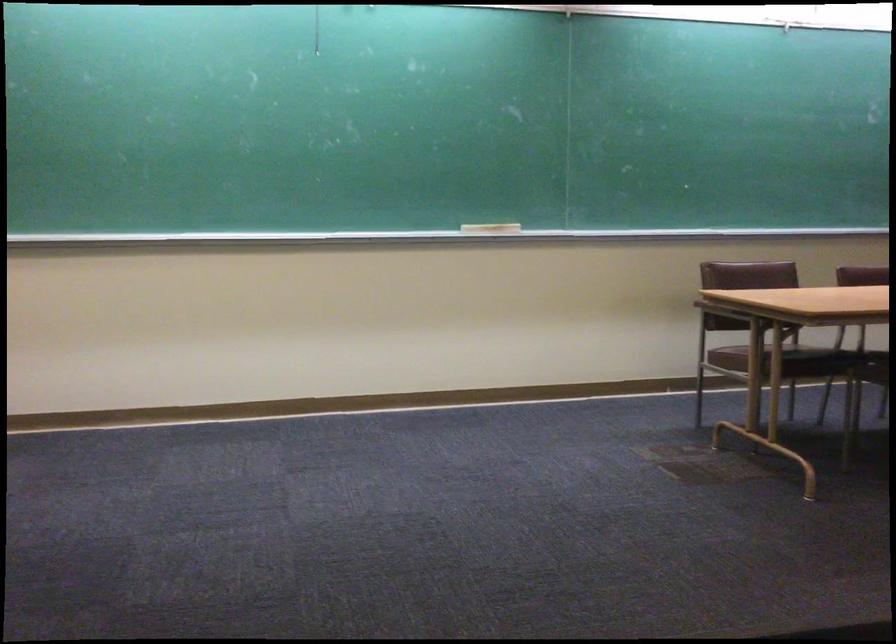
This screenshot has width=896, height=644. I want to click on chalkboard eraser, so click(x=490, y=228).